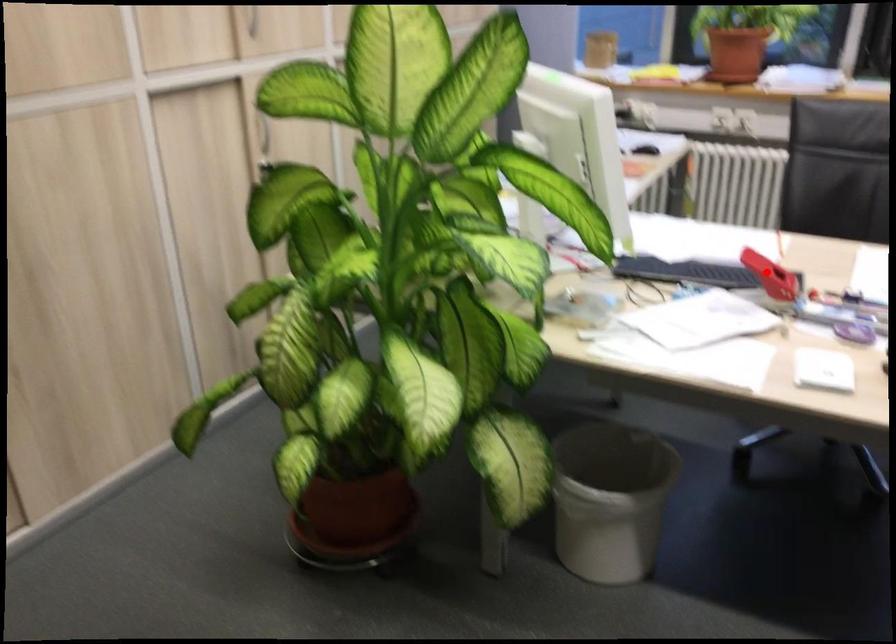
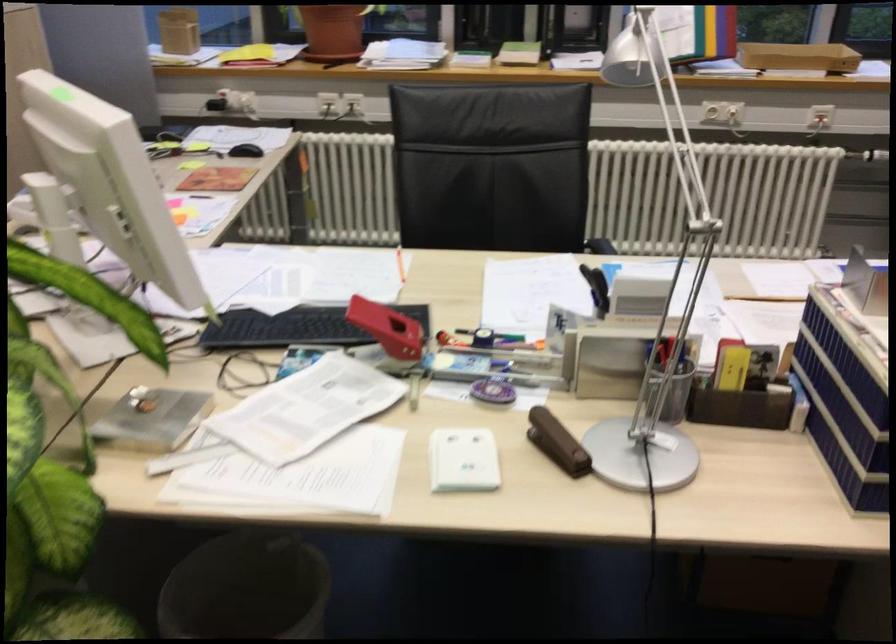
Where in the second image is the point corresponding to the highlighted location from the first image?

(386, 328)